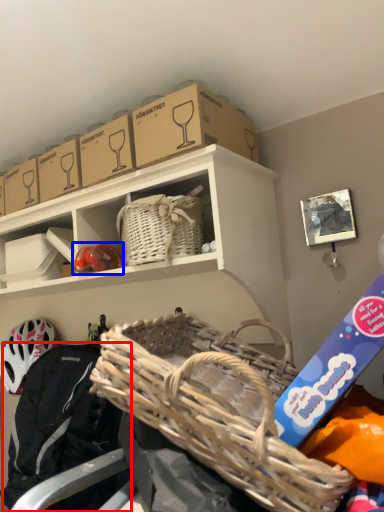
Question: Which point is further to the camera, clothing (highlighted by a red box) or bicycle helmet (highlighted by a blue box)?

Choices:
 (A) clothing
 (B) bicycle helmet

Answer: (B)